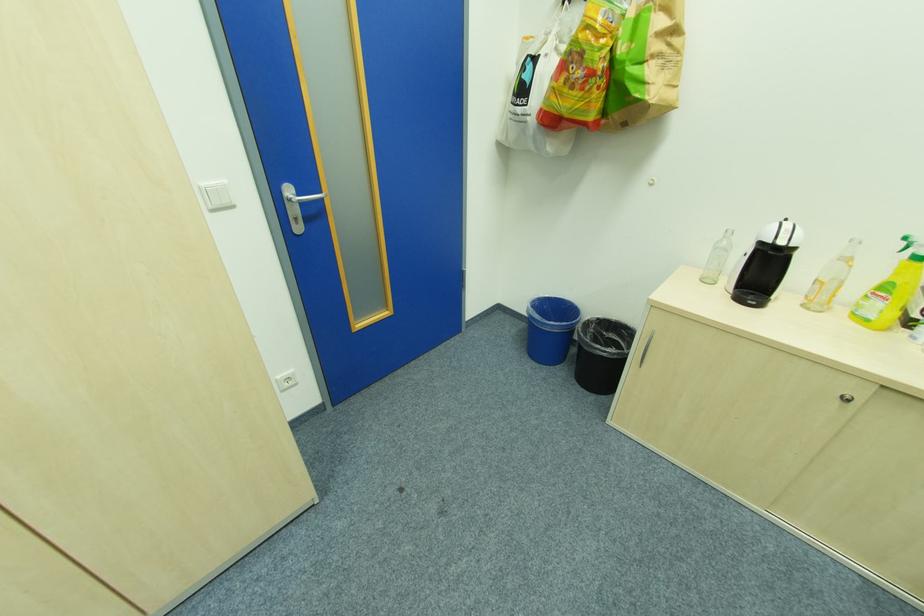
Image resolution: width=924 pixels, height=616 pixels. In order to click on white light switch in this screenshot , I will do `click(216, 196)`.